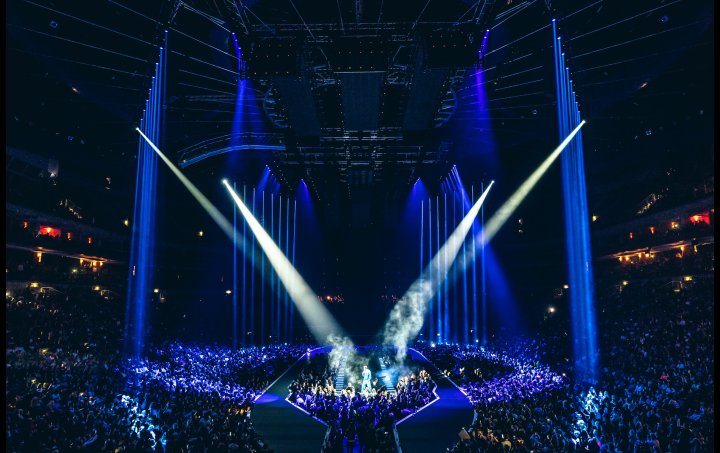
Identify the location of yellow lights. (222, 180), (135, 129), (587, 118), (494, 180).